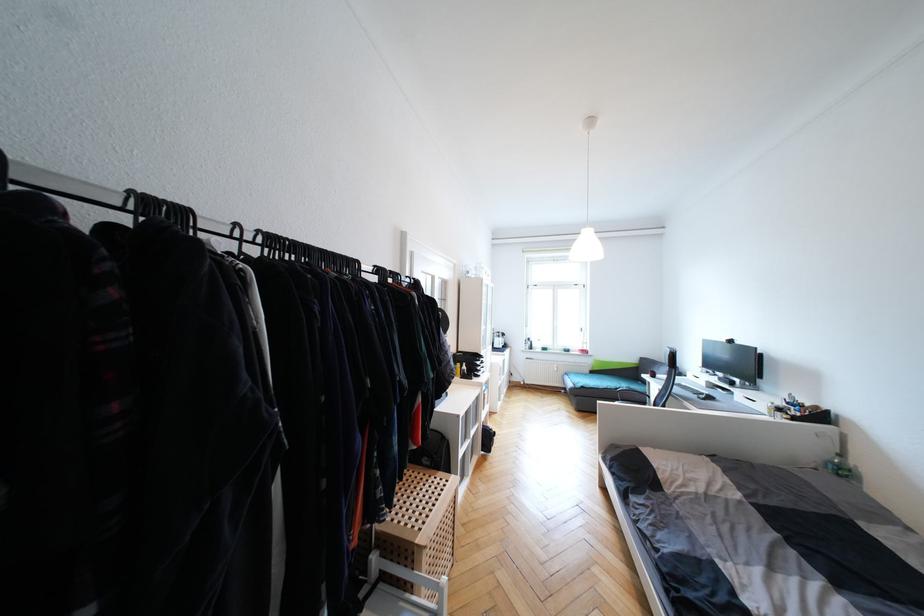
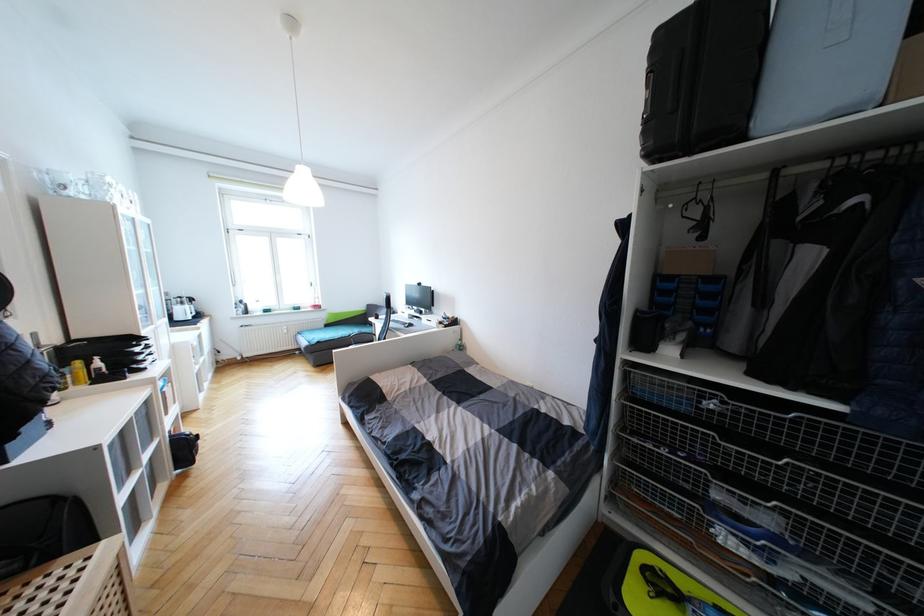
In the second image, find the point that corresponds to (x=462, y=366) in the first image.

(81, 363)